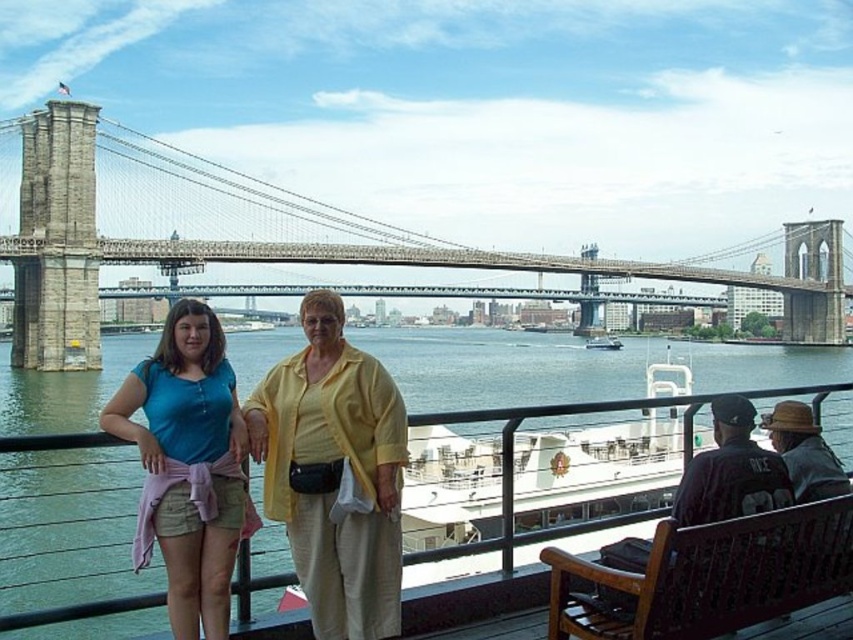
Question: Can you confirm if green water at lower center is positioned to the right of white matte boat at center?

Choices:
 (A) no
 (B) yes

Answer: (A)

Question: Is matte yellow blouse at center behind brown wooden bench at lower right?

Choices:
 (A) yes
 (B) no

Answer: (A)

Question: Is green water at lower center closer to camera compared to stone suspension bridge at center?

Choices:
 (A) yes
 (B) no

Answer: (A)

Question: Which point is closer to the camera taking this photo?

Choices:
 (A) (218, 451)
 (B) (346, 260)

Answer: (A)

Question: Considering the real-world distances, which object is closest to the brown wooden bench at lower right?

Choices:
 (A) green water at lower center
 (B) matte yellow blouse at center
 (C) matte blue shirt at center
 (D) stone suspension bridge at center

Answer: (B)

Question: Which object is closer to the camera taking this photo?

Choices:
 (A) matte yellow blouse at center
 (B) green water at lower center
 (C) matte blue shirt at center

Answer: (A)